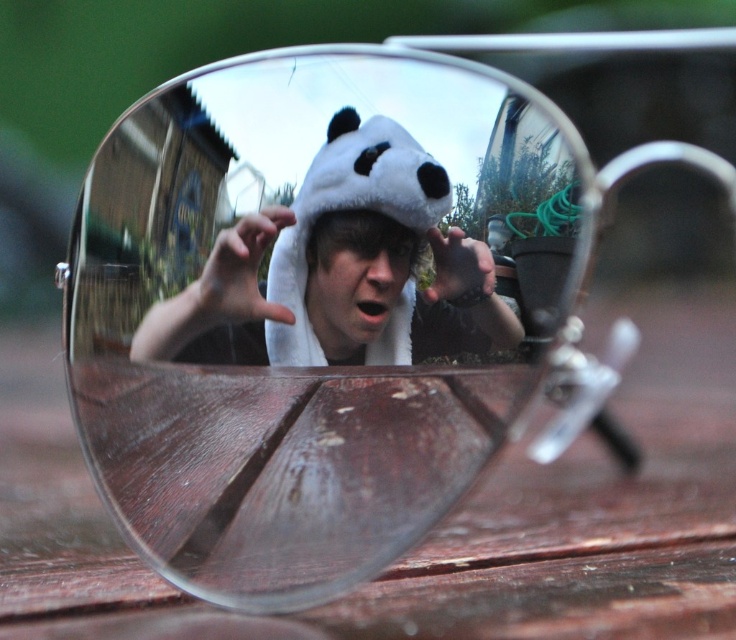
Question: Does white plush panda hat at center have a smaller size compared to white plush hat at center?

Choices:
 (A) no
 (B) yes

Answer: (A)

Question: Among these points, which one is nearest to the camera?

Choices:
 (A) (400, 285)
 (B) (383, 294)

Answer: (A)

Question: Observing the image, what is the correct spatial positioning of white plush panda hat at center in reference to white plush hat at center?

Choices:
 (A) below
 (B) above

Answer: (B)

Question: Which point appears farthest from the camera in this image?

Choices:
 (A) (367, 317)
 (B) (319, 328)

Answer: (B)

Question: Which object appears farthest from the camera in this image?

Choices:
 (A) white plush panda hat at center
 (B) white plush hat at center

Answer: (B)

Question: Is white plush panda hat at center to the left of white plush hat at center from the viewer's perspective?

Choices:
 (A) no
 (B) yes

Answer: (B)